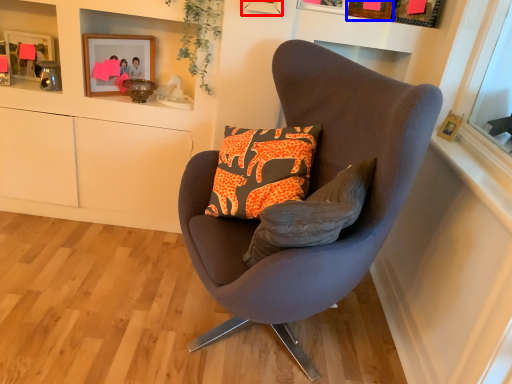
Question: Which object appears closest to the camera in this image, picture frame (highlighted by a red box) or picture frame (highlighted by a blue box)?

Choices:
 (A) picture frame
 (B) picture frame

Answer: (A)